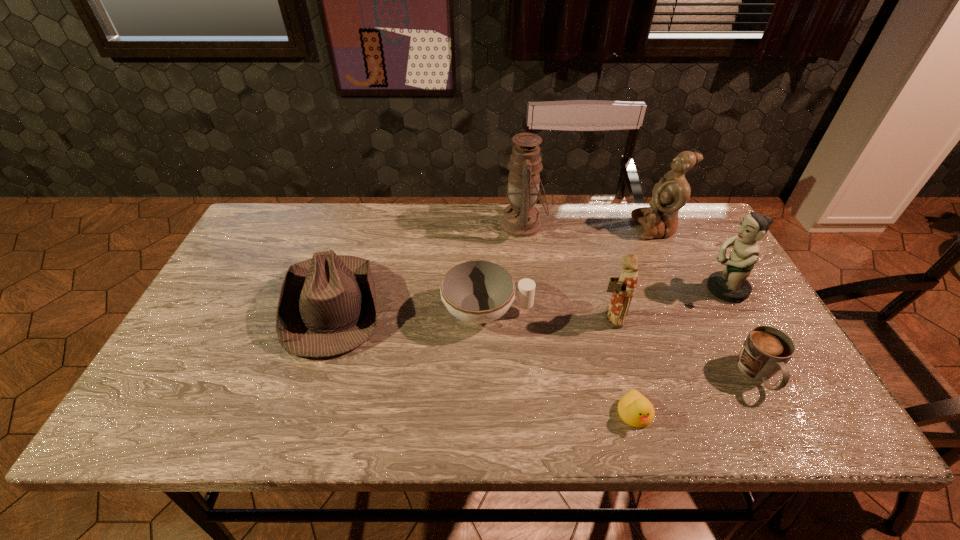
Where is `vacant space located 0.270m on the front-facing side of the farthest figurine`? This screenshot has width=960, height=540. vacant space located 0.270m on the front-facing side of the farthest figurine is located at coordinates (549, 227).

Where is `free location located on the front-facing side of the farthest figurine`? This screenshot has height=540, width=960. free location located on the front-facing side of the farthest figurine is located at coordinates (520, 227).

What are the coordinates of `free space located 0.390m on the front-facing side of the farthest figurine` in the screenshot? It's located at (512, 227).

Where is `free space located 0.380m on the front-facing side of the second nearest figurine`? free space located 0.380m on the front-facing side of the second nearest figurine is located at coordinates (563, 289).

The width and height of the screenshot is (960, 540). What are the coordinates of `vacant region located on the front-facing side of the second nearest figurine` in the screenshot? It's located at click(636, 289).

This screenshot has width=960, height=540. I want to click on free point located on the front-facing side of the second nearest figurine, so click(610, 289).

At what (x,y) coordinates should I click in order to perform the action: click on free space located on the front-facing side of the nearest figurine. Please return your answer as a coordinate pair (x, y). Image resolution: width=960 pixels, height=540 pixels. Looking at the image, I should click on tap(561, 319).

This screenshot has height=540, width=960. In order to click on free point located on the front-facing side of the nearest figurine in this screenshot , I will do `click(451, 319)`.

Where is `vacant area situated on the front-facing side of the nearest figurine`? vacant area situated on the front-facing side of the nearest figurine is located at coordinates (478, 319).

Where is `vacant space situated 0.110m on the left of the fedora`? The height and width of the screenshot is (540, 960). vacant space situated 0.110m on the left of the fedora is located at coordinates (243, 304).